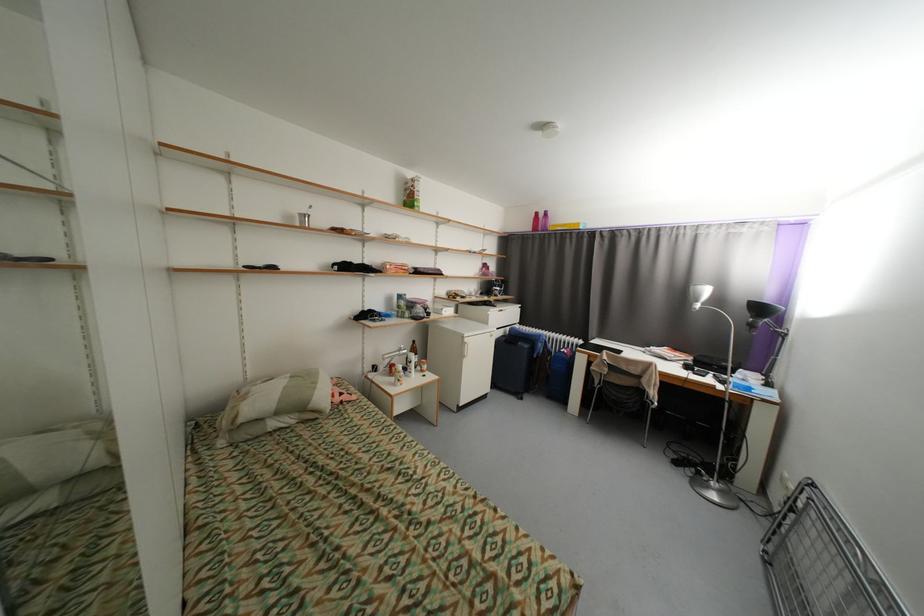
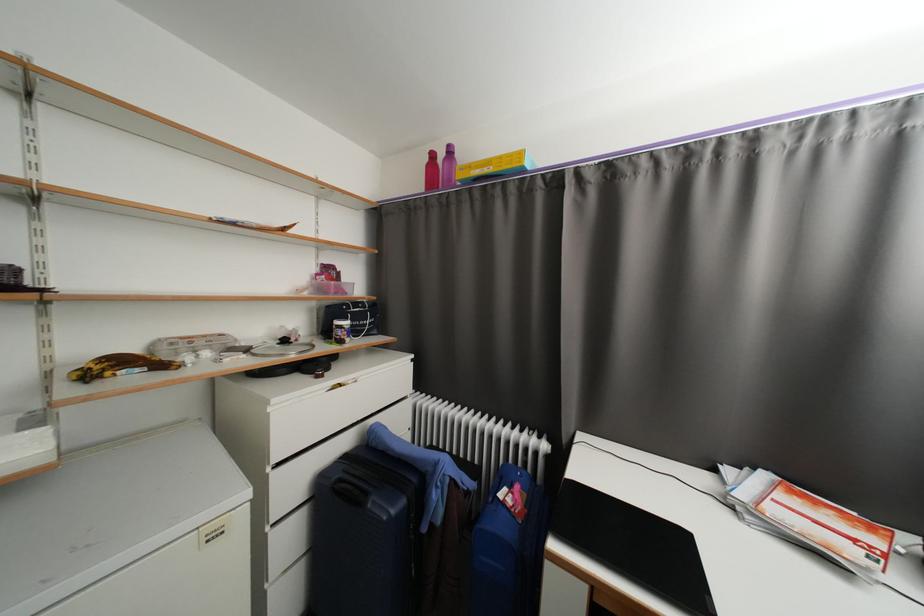
Locate, in the second image, the point that corresponds to (x=504, y=293) in the first image.

(346, 334)